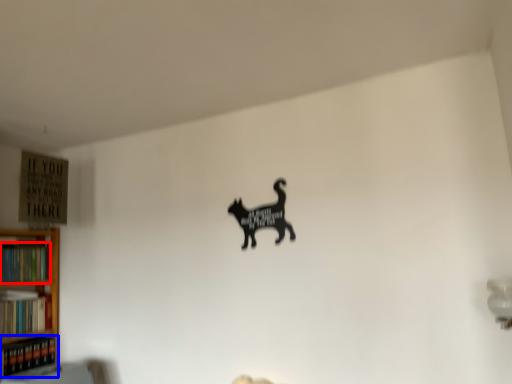
Question: Which object appears closest to the camera in this image, book (highlighted by a red box) or book (highlighted by a blue box)?

Choices:
 (A) book
 (B) book

Answer: (B)